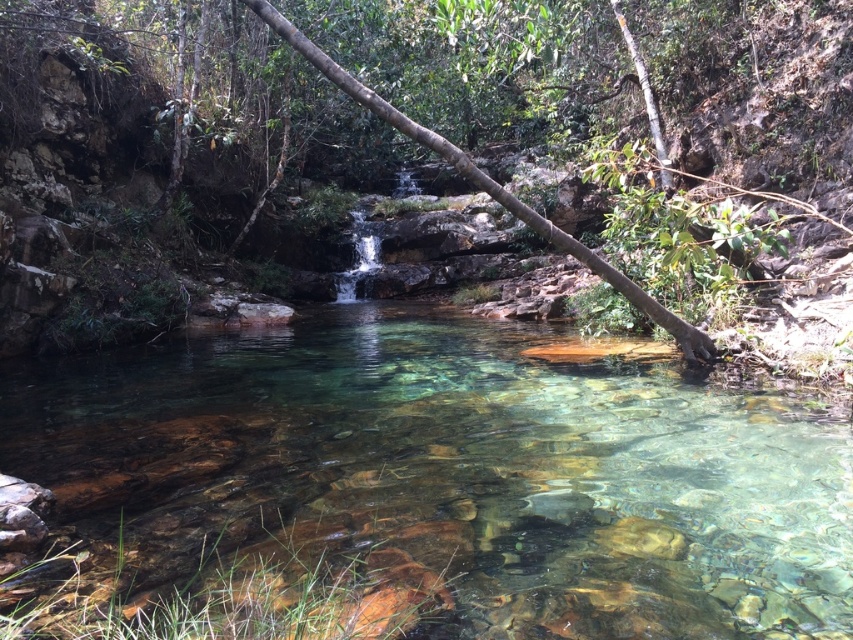
From the picture: You are standing at the edge of a forest path and see the clear glassy stream at center ahead. You want to cross the stream using a wooden plank that is 10 feet long. Will the plank be long enough to safely cross the stream?

The distance between you and the clear glassy stream at center is 9.36 feet. Since the wooden plank is 10 feet long, it will be long enough to safely cross the stream.

You are standing at the edge of the stream and want to reach a point in the scene. You have two options to choose from, point A at coordinates point (64, 364) and point B at coordinates point (329, 58). Which point is closer to you?

Point A at coordinates point (64, 364) is closer to you because it is further to the viewer than point B at coordinates point (329, 58).

You are a hiker who wants to cross the stream. You notice the clear glassy stream at center and the brown wood tree at center. Which object is located higher in the scene?

The brown wood tree at center is higher than the clear glassy stream at center because the stream is positioned below the tree.